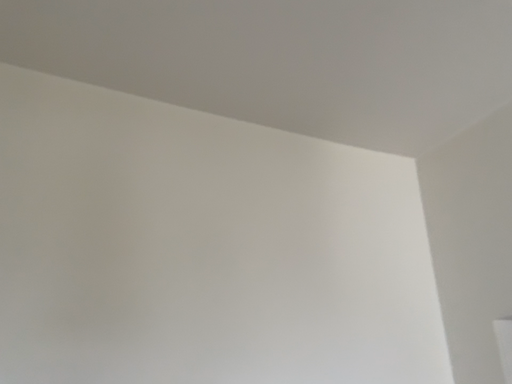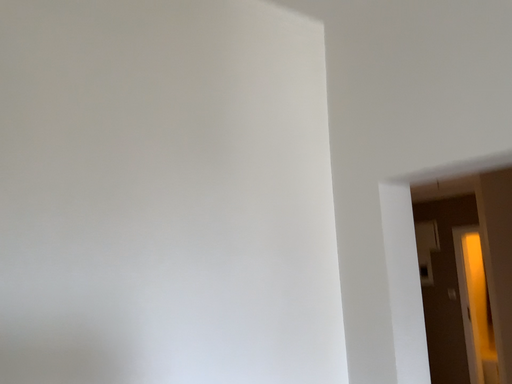
Question: Which way did the camera rotate in the video?

Choices:
 (A) rotated right
 (B) rotated left

Answer: (A)